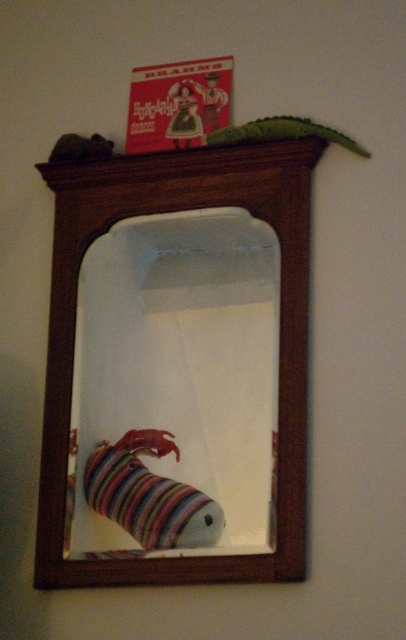
Does green fabric alligator at upper center have a smaller size compared to matte plastic cowboy at upper center?

Incorrect, green fabric alligator at upper center is not smaller in size than matte plastic cowboy at upper center.

Can you confirm if green fabric alligator at upper center is bigger than matte plastic cowboy at upper center?

Yes.

Image resolution: width=406 pixels, height=640 pixels. Identify the location of green fabric alligator at upper center. (282, 132).

Which is below, wooden mirror at upper center or velvet plush toy at upper left?

wooden mirror at upper center is below.

Looking at this image, is wooden mirror at upper center shorter than velvet plush toy at upper left?

No, wooden mirror at upper center is not shorter than velvet plush toy at upper left.

Which is in front, point (300, 419) or point (53, 161)?

Point (300, 419) is more forward.

The image size is (406, 640). What are the coordinates of `wooden mirror at upper center` in the screenshot? It's located at (280, 339).

Between matte plastic toy at upper center and matte plastic cowboy at upper center, which one appears on the left side from the viewer's perspective?

From the viewer's perspective, matte plastic toy at upper center appears more on the left side.

Does point (194, 145) lie behind point (202, 118)?

No.

The height and width of the screenshot is (640, 406). In order to click on matte plastic toy at upper center in this screenshot , I will do `click(183, 116)`.